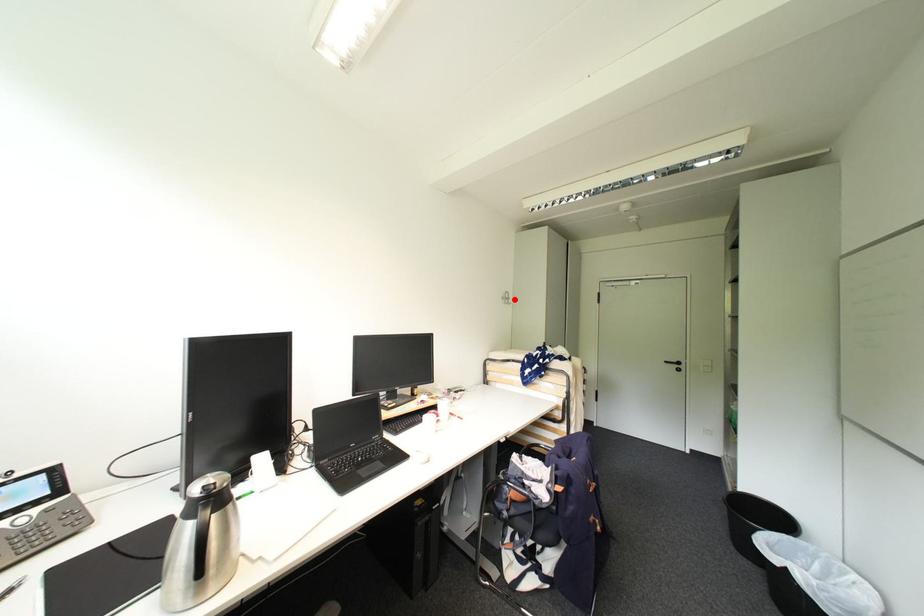
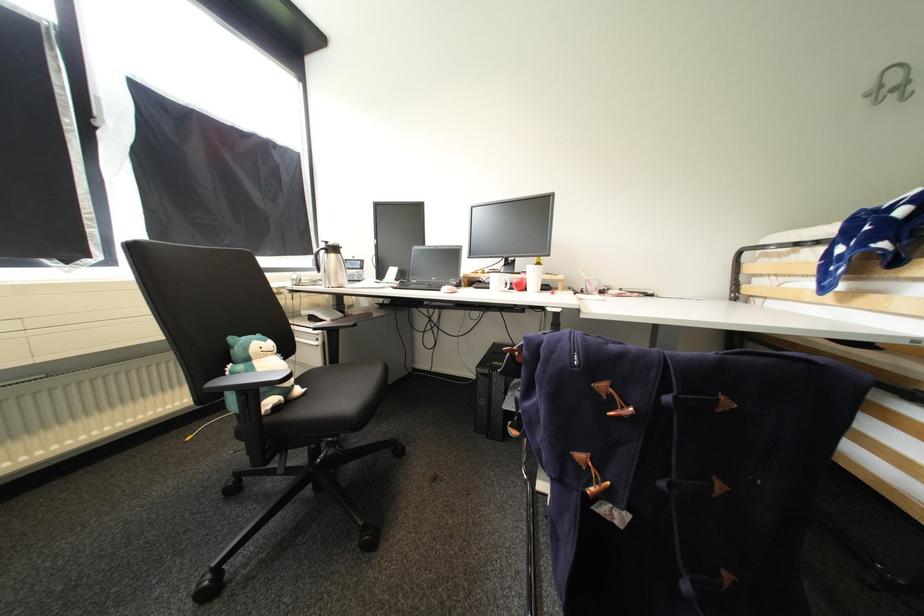
In the second image, find the point that corresponds to the highlighted location in the first image.

(912, 84)